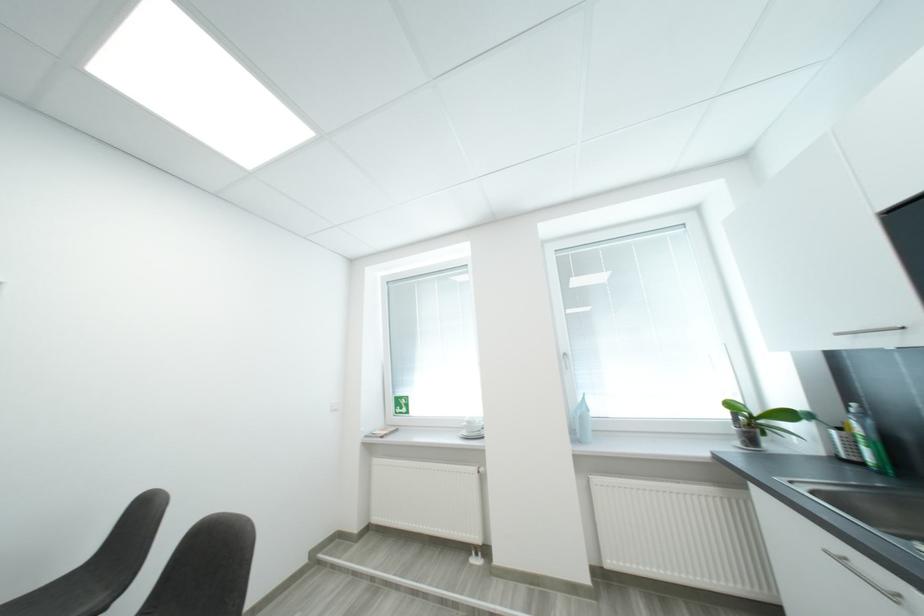
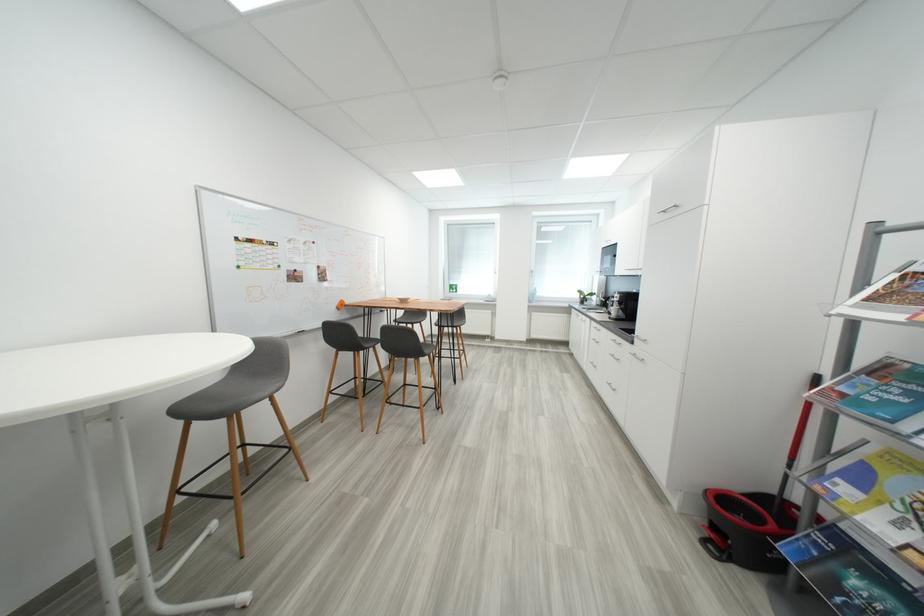
In a continuous first-person perspective shot, in which direction is the camera moving?

The cameraman moved toward left, backward.